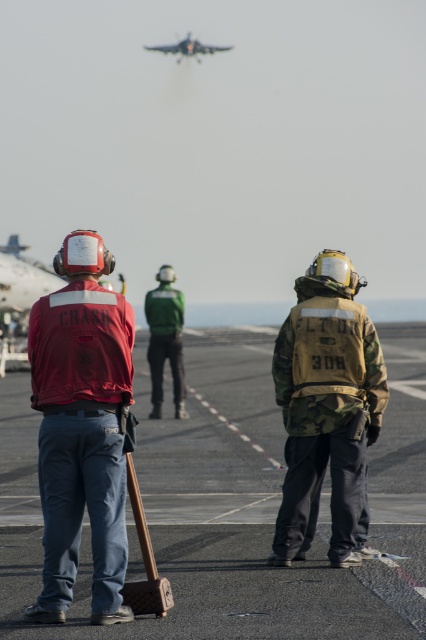
Question: Which of the following is the closest to the observer?

Choices:
 (A) metallic silver jet at upper center
 (B) green fabric jacket at center

Answer: (B)

Question: Considering the relative positions of matte red jacket at left and metallic silver jet at upper center in the image provided, where is matte red jacket at left located with respect to metallic silver jet at upper center?

Choices:
 (A) left
 (B) right

Answer: (B)

Question: Is camo fabric backpack at center wider than metallic silver jet at upper center?

Choices:
 (A) no
 (B) yes

Answer: (A)

Question: Among these points, which one is nearest to the camera?

Choices:
 (A) (307, 445)
 (B) (89, 300)

Answer: (B)

Question: Which point is farther to the camera?

Choices:
 (A) metallic silver jet at upper center
 (B) green fabric jacket at center

Answer: (A)

Question: Does green fabric jacket at center appear under metallic silver jet at upper center?

Choices:
 (A) yes
 (B) no

Answer: (A)